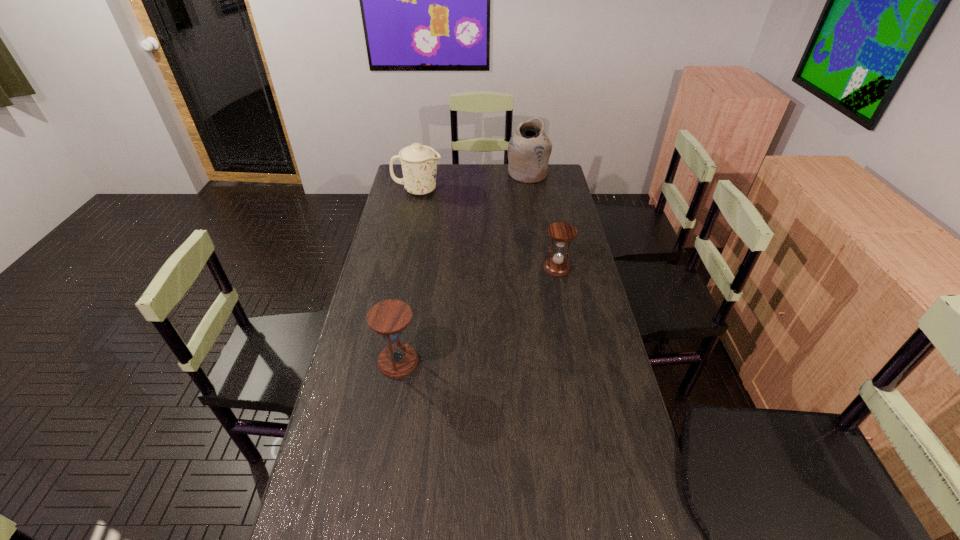
Where is `the third closest object to the chinaware`? the third closest object to the chinaware is located at coordinates (389, 318).

Image resolution: width=960 pixels, height=540 pixels. I want to click on vacant space that satisfies the following two spatial constraints: 1. on the spout of the second nearest object; 2. on the right side of the chinaware, so click(402, 268).

You are a GUI agent. You are given a task and a screenshot of the screen. Output one action in this format:
    pyautogui.click(x=<x>, y=<y>)
    Task: Click on the vacant space that satisfies the following two spatial constraints: 1. on the back side of the left hourglass; 2. on the left side of the pottery
    Image resolution: width=960 pixels, height=540 pixels.
    Given the screenshot: What is the action you would take?
    pyautogui.click(x=430, y=174)

Where is `vacant space that satisfies the following two spatial constraints: 1. on the spout of the chinaware; 2. on the left side of the shortest object`? This screenshot has width=960, height=540. vacant space that satisfies the following two spatial constraints: 1. on the spout of the chinaware; 2. on the left side of the shortest object is located at coordinates (402, 268).